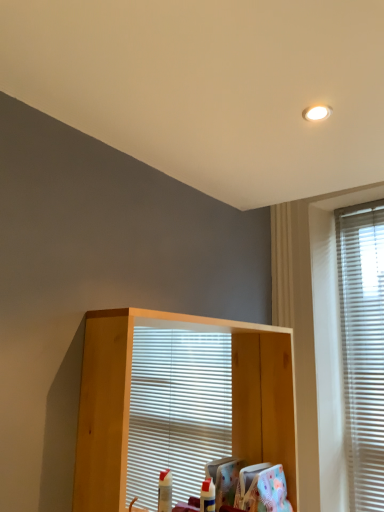
Question: From the image's perspective, is white blinds at right on top of light wood shelf at center?

Choices:
 (A) no
 (B) yes

Answer: (B)

Question: Could you tell me if white blinds at right is turned towards light wood shelf at center?

Choices:
 (A) no
 (B) yes

Answer: (A)

Question: Is light wood shelf at center a part of white blinds at right?

Choices:
 (A) yes
 (B) no

Answer: (B)

Question: Is white blinds at right shorter than light wood shelf at center?

Choices:
 (A) no
 (B) yes

Answer: (A)

Question: Is white blinds at right positioned in front of light wood shelf at center?

Choices:
 (A) yes
 (B) no

Answer: (B)

Question: Can you confirm if white blinds at right is bigger than light wood shelf at center?

Choices:
 (A) no
 (B) yes

Answer: (A)

Question: Does light wood shelf at center have a greater width compared to white blinds at right?

Choices:
 (A) no
 (B) yes

Answer: (B)

Question: Is light wood shelf at center far away from white blinds at right?

Choices:
 (A) no
 (B) yes

Answer: (A)

Question: From a real-world perspective, is light wood shelf at center below white blinds at right?

Choices:
 (A) no
 (B) yes

Answer: (B)

Question: Can you confirm if light wood shelf at center is smaller than white blinds at right?

Choices:
 (A) yes
 (B) no

Answer: (B)

Question: Does light wood shelf at center appear on the right side of white blinds at right?

Choices:
 (A) yes
 (B) no

Answer: (B)

Question: Is light wood shelf at center positioned beyond the bounds of white blinds at right?

Choices:
 (A) yes
 (B) no

Answer: (A)

Question: From their relative heights in the image, would you say light wood shelf at center is taller or shorter than white blinds at right?

Choices:
 (A) short
 (B) tall

Answer: (A)